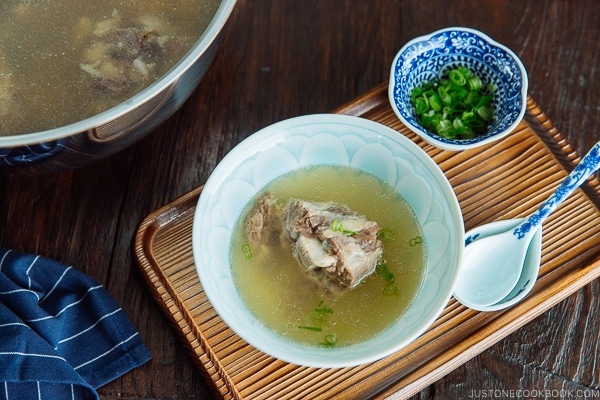
Find the location of a particular element. blue and white decorative bowl is located at coordinates (508, 87).